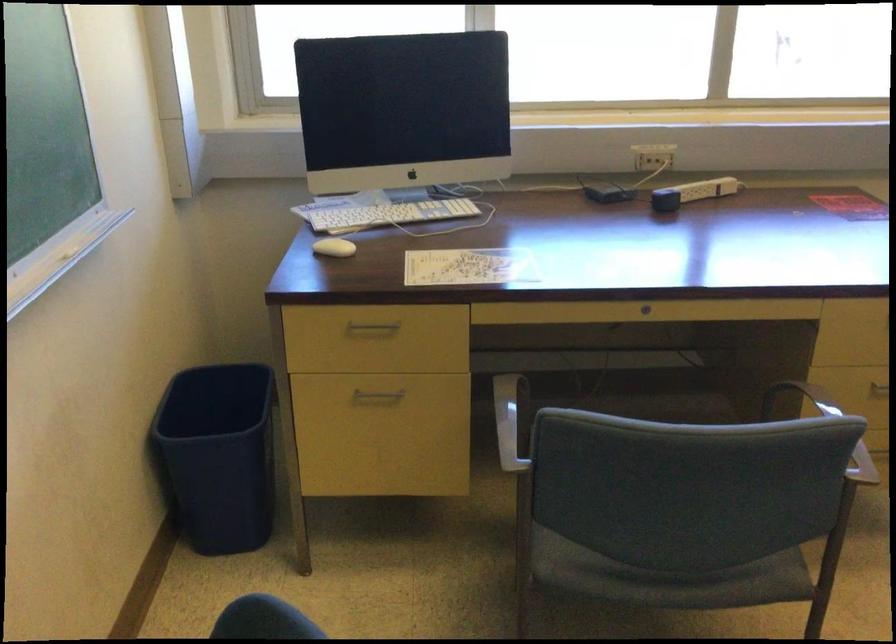
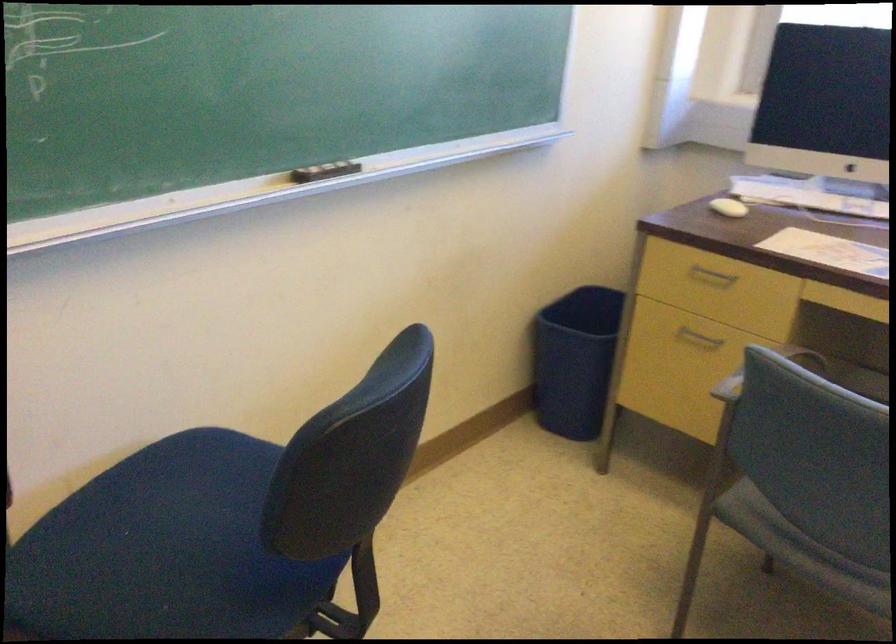
Find the pixel in the second image that matches pixel 220 474 in the first image.

(574, 360)